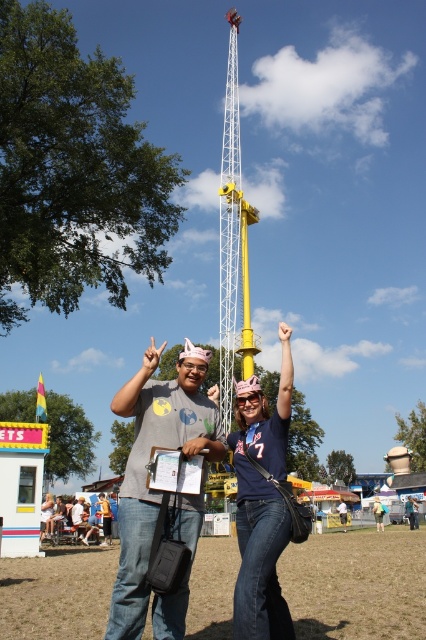
Between denim jeans at center and yellow metallic tower at center, which one has more height?

Standing taller between the two is yellow metallic tower at center.

From the picture: Who is more distant from viewer, (242,404) or (241,275)?

Positioned behind is point (241,275).

Is point (284, 627) closer to viewer compared to point (242, 298)?

Yes, it is.

Locate an element on the screen. denim jeans at center is located at coordinates (261, 502).

Which is more to the right, matte gray t-shirt at center or denim jeans at lower center?

matte gray t-shirt at center

Is point (143, 545) positioned in front of point (106, 500)?

That is True.

Locate an element on the screen. The image size is (426, 640). matte gray t-shirt at center is located at coordinates (146, 468).

Who is more forward, [325,547] or [89,525]?

Positioned in front is point [325,547].

Who is positioned more to the left, brown grass at lower center or denim jeans at lower center?

From the viewer's perspective, denim jeans at lower center appears more on the left side.

Find the location of `brown grass at lower center`. brown grass at lower center is located at coordinates (356, 586).